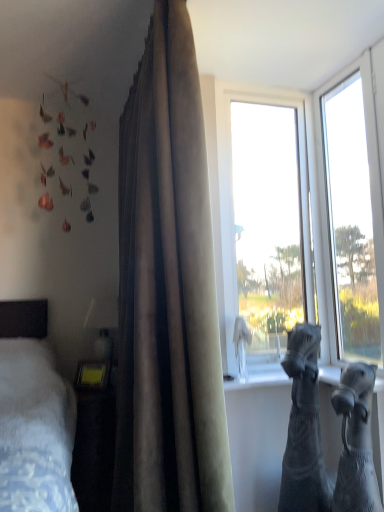
Question: Does black knitted socks at lower right, positioned as the 1th animal in front-to-back order, appear on the right side of satin-like beige curtain at center?

Choices:
 (A) yes
 (B) no

Answer: (A)

Question: From the image's perspective, is black knitted socks at lower right, positioned as the 1th animal in front-to-back order, on satin-like beige curtain at center?

Choices:
 (A) no
 (B) yes

Answer: (A)

Question: Is black knitted socks at lower right, positioned as the second animal in back-to-front order, facing towards satin-like beige curtain at center?

Choices:
 (A) yes
 (B) no

Answer: (B)

Question: Is black knitted socks at lower right, positioned as the 1th animal in front-to-back order, wider than satin-like beige curtain at center?

Choices:
 (A) yes
 (B) no

Answer: (B)

Question: From a real-world perspective, does black knitted socks at lower right, positioned as the second animal in back-to-front order, stand above satin-like beige curtain at center?

Choices:
 (A) yes
 (B) no

Answer: (B)

Question: From the image's perspective, is transparent glass window at upper right, positioned as the first window in left-to-right order, above or below black knitted socks at lower right, positioned as the 1th animal in front-to-back order?

Choices:
 (A) above
 (B) below

Answer: (A)

Question: Is point (321, 263) closer or farther from the camera than point (367, 445)?

Choices:
 (A) closer
 (B) farther

Answer: (B)

Question: In terms of width, does transparent glass window at upper right, which is counted as the second window, starting from the right, look wider or thinner when compared to black knitted socks at lower right, positioned as the second animal in back-to-front order?

Choices:
 (A) wide
 (B) thin

Answer: (B)

Question: From a real-world perspective, relative to black knitted socks at lower right, positioned as the 1th animal in front-to-back order, is transparent glass window at upper right, which is counted as the second window, starting from the right, vertically above or below?

Choices:
 (A) below
 (B) above

Answer: (B)

Question: Based on their positions, is black denim jeans at lower right, positioned as the second animal in front-to-back order, located to the left or right of transparent glass window at upper right, which is the 2th window from left to right?

Choices:
 (A) left
 (B) right

Answer: (A)

Question: From the image's perspective, is black denim jeans at lower right, positioned as the second animal in front-to-back order, located above or below transparent glass window at upper right, which is the 2th window from left to right?

Choices:
 (A) above
 (B) below

Answer: (B)

Question: From a real-world perspective, relative to transparent glass window at upper right, placed as the first window when sorted from right to left, is black denim jeans at lower right, positioned as the second animal in front-to-back order, vertically above or below?

Choices:
 (A) above
 (B) below

Answer: (B)

Question: From their relative heights in the image, would you say black denim jeans at lower right, the first animal positioned from the back, is taller or shorter than transparent glass window at upper right, placed as the first window when sorted from right to left?

Choices:
 (A) short
 (B) tall

Answer: (A)

Question: Is point (148, 330) positioned closer to the camera than point (291, 356)?

Choices:
 (A) farther
 (B) closer

Answer: (B)

Question: From the image's perspective, is satin-like beige curtain at center positioned above or below black denim jeans at lower right, positioned as the second animal in front-to-back order?

Choices:
 (A) below
 (B) above

Answer: (B)